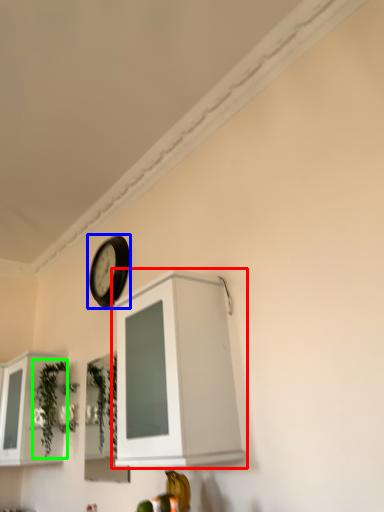
Question: Which object is the farthest from cabinetry (highlighted by a red box)? Choose among these: clock (highlighted by a blue box) or plant (highlighted by a green box).

Choices:
 (A) clock
 (B) plant

Answer: (B)